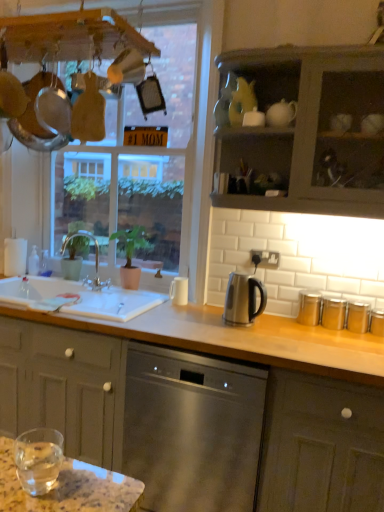
Question: Considering the relative positions of satin silver kettle at center and matte gray cabinet at upper right, the 1th cabinetry positioned from the top, in the image provided, is satin silver kettle at center to the left or to the right of matte gray cabinet at upper right, the 1th cabinetry positioned from the top,?

Choices:
 (A) right
 (B) left

Answer: (B)

Question: Looking at the image, does satin silver kettle at center seem bigger or smaller compared to matte gray cabinet at upper right, acting as the second cabinetry starting from the bottom?

Choices:
 (A) small
 (B) big

Answer: (A)

Question: Which is nearer to the white matte cup at center?

Choices:
 (A) matte gray cabinet at upper right, acting as the second cabinetry starting from the bottom
 (B) satin silver kettle at center
 (C) stainless steel dishwasher at center
 (D) green matte plant at center
 (E) clear glass window at upper center

Answer: (B)

Question: Considering the real-world distances, which object is farthest from the satin silver kettle at center?

Choices:
 (A) clear glass water at lower left
 (B) brushed metal faucet at sink left
 (C) green matte plant at center
 (D) white matte cup at center
 (E) clear glass window at upper center

Answer: (A)